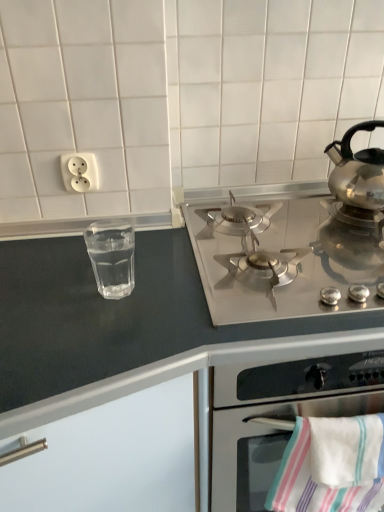
Question: Does satin silver gas stove at upper right lie behind polished stainless steel kettle at right?

Choices:
 (A) no
 (B) yes

Answer: (A)

Question: Are satin silver gas stove at upper right and polished stainless steel kettle at right beside each other?

Choices:
 (A) no
 (B) yes

Answer: (A)

Question: Is satin silver gas stove at upper right positioned with its back to polished stainless steel kettle at right?

Choices:
 (A) yes
 (B) no

Answer: (B)

Question: From the image's perspective, would you say satin silver gas stove at upper right is shown under polished stainless steel kettle at right?

Choices:
 (A) no
 (B) yes

Answer: (B)

Question: Is the position of satin silver gas stove at upper right less distant than that of polished stainless steel kettle at right?

Choices:
 (A) yes
 (B) no

Answer: (A)

Question: From their relative heights in the image, would you say polished stainless steel kettle at right is taller or shorter than transparent glass at left?

Choices:
 (A) tall
 (B) short

Answer: (A)

Question: Relative to transparent glass at left, is polished stainless steel kettle at right in front or behind?

Choices:
 (A) behind
 (B) front

Answer: (A)

Question: Is polished stainless steel kettle at right bigger or smaller than transparent glass at left?

Choices:
 (A) small
 (B) big

Answer: (B)

Question: From a real-world perspective, is polished stainless steel kettle at right physically located above or below transparent glass at left?

Choices:
 (A) below
 (B) above

Answer: (B)

Question: In the image, is white plastic outlet at upper left positioned in front of or behind stainless steel gas stove at upper center?

Choices:
 (A) front
 (B) behind

Answer: (B)

Question: Considering the positions of point (61, 158) and point (16, 385), is point (61, 158) closer or farther from the camera than point (16, 385)?

Choices:
 (A) farther
 (B) closer

Answer: (A)

Question: Considering the positions of white plastic outlet at upper left and stainless steel gas stove at upper center in the image, is white plastic outlet at upper left taller or shorter than stainless steel gas stove at upper center?

Choices:
 (A) short
 (B) tall

Answer: (A)

Question: Would you say white plastic outlet at upper left is to the left or to the right of stainless steel gas stove at upper center in the picture?

Choices:
 (A) left
 (B) right

Answer: (A)

Question: Looking at the image, does stainless steel gas stove at upper center seem bigger or smaller compared to white striped towel at lower right?

Choices:
 (A) small
 (B) big

Answer: (B)

Question: Does point (206, 347) appear closer or farther from the camera than point (294, 468)?

Choices:
 (A) closer
 (B) farther

Answer: (A)